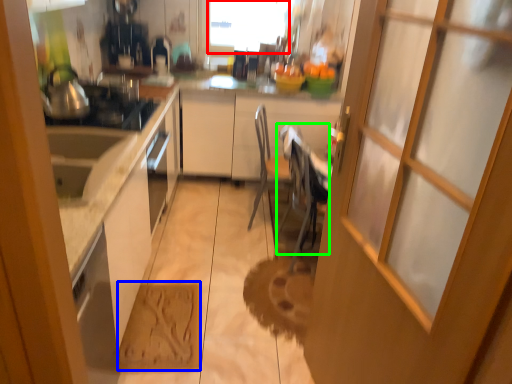
Question: Based on their relative distances, which object is nearer to window screen (highlighted by a red box)? Choose from cardboard (highlighted by a blue box) and chair (highlighted by a green box).

Choices:
 (A) cardboard
 (B) chair

Answer: (B)